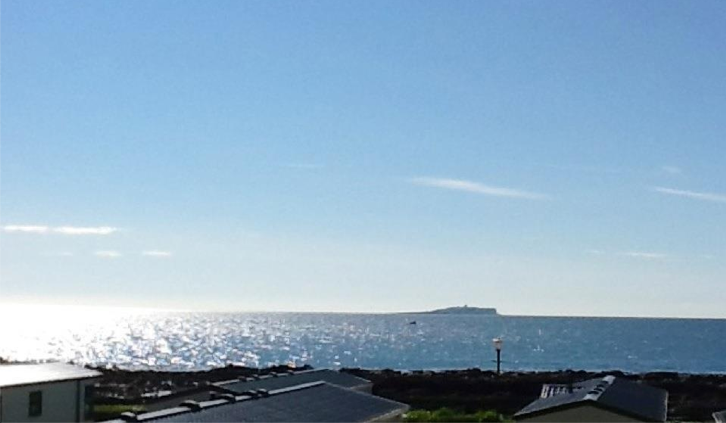
The image size is (726, 423). Find the location of `window`. window is located at coordinates (36, 400).